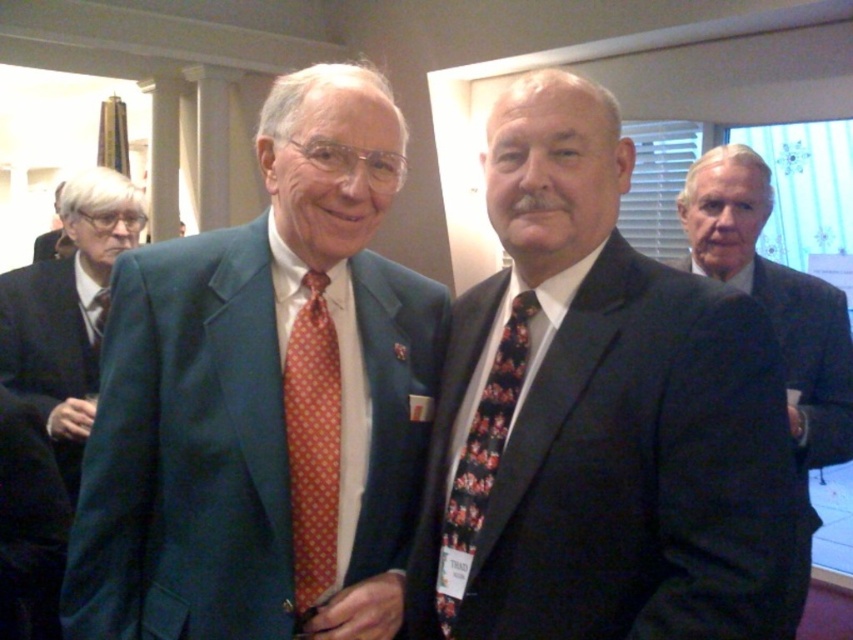
Question: Does black wool suit at right appear on the left side of matte black suit at left?

Choices:
 (A) yes
 (B) no

Answer: (B)

Question: Considering the real-world distances, which object is farthest from the black wool suit at right?

Choices:
 (A) dark suit at center
 (B) orange dotted fabric tie at left
 (C) matte black suit at left

Answer: (C)

Question: Which point is closer to the camera?

Choices:
 (A) (466, 531)
 (B) (561, 212)
 (C) (811, 408)
 (D) (57, 220)

Answer: (B)

Question: Is matte green suit at center further to the viewer compared to dark suit at center?

Choices:
 (A) yes
 (B) no

Answer: (A)

Question: Which point is farther to the camera?

Choices:
 (A) pyautogui.click(x=90, y=250)
 (B) pyautogui.click(x=798, y=410)
 (C) pyautogui.click(x=483, y=483)
 (D) pyautogui.click(x=323, y=477)

Answer: (A)

Question: Does matte black suit at left have a smaller size compared to orange dotted fabric tie at left?

Choices:
 (A) no
 (B) yes

Answer: (A)